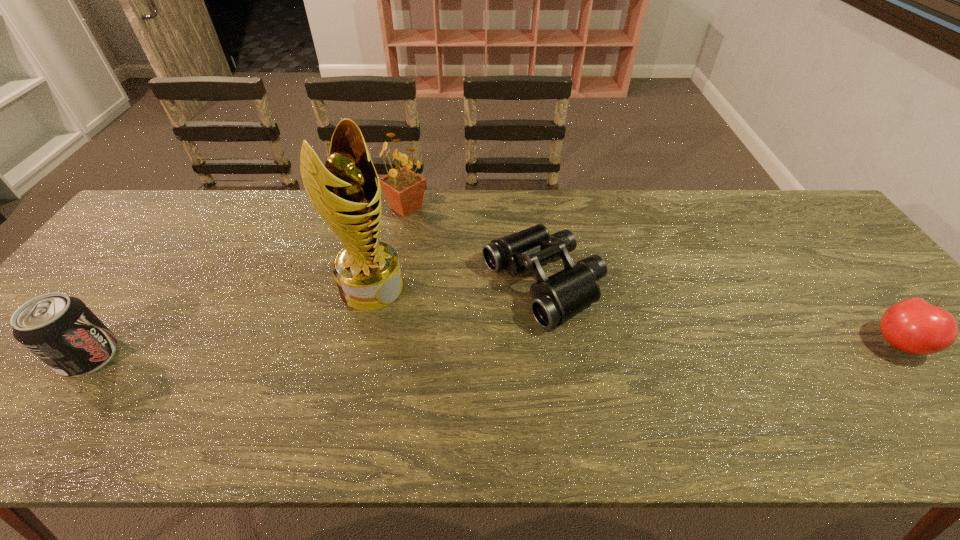
Where is `object present at the right edge`? object present at the right edge is located at coordinates (913, 326).

Locate an element on the screen. Image resolution: width=960 pixels, height=540 pixels. object that is at the near left corner is located at coordinates (60, 330).

The image size is (960, 540). I want to click on free space at the far edge of the desktop, so pyautogui.click(x=293, y=210).

The width and height of the screenshot is (960, 540). I want to click on vacant region at the near edge of the desktop, so click(x=770, y=402).

In order to click on vacant area at the right edge in this screenshot , I will do `click(876, 338)`.

Find the location of `blank space at the far left corner`. blank space at the far left corner is located at coordinates (154, 233).

Identify the location of free region at the far right corner of the desktop. (785, 197).

At what (x,y) coordinates should I click in order to perform the action: click on free space between the apple and the binoculars. Please return your answer as a coordinate pair (x, y). Looking at the image, I should click on (721, 314).

You are a GUI agent. You are given a task and a screenshot of the screen. Output one action in this format:
    pyautogui.click(x=<x>, y=<y>)
    Task: Click on the empty location between the third shortest object and the tallest object
    
    Given the screenshot: What is the action you would take?
    pyautogui.click(x=230, y=321)

Where is `free space between the apple and the tallest object`? The height and width of the screenshot is (540, 960). free space between the apple and the tallest object is located at coordinates (636, 315).